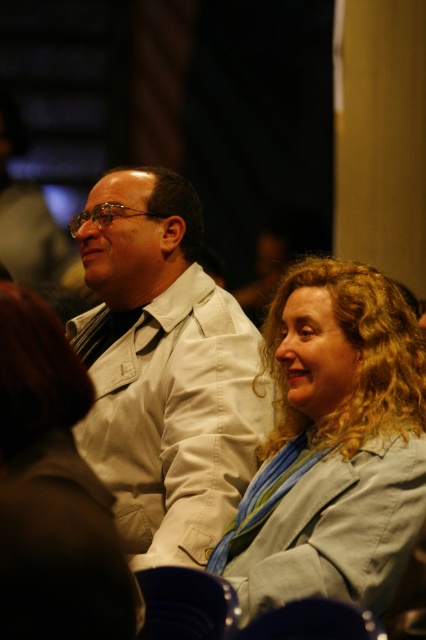
Question: Which point is farther to the camera?

Choices:
 (A) light beige jacket at center
 (B) light blue fabric jacket at center

Answer: (A)

Question: Which point is farther to the camera?

Choices:
 (A) (270, 548)
 (B) (164, 352)

Answer: (B)

Question: Is light beige jacket at center thinner than light blue fabric jacket at center?

Choices:
 (A) no
 (B) yes

Answer: (A)

Question: Does light beige jacket at center have a lesser width compared to light blue fabric jacket at center?

Choices:
 (A) no
 (B) yes

Answer: (A)

Question: Is light beige jacket at center positioned behind light blue fabric jacket at center?

Choices:
 (A) yes
 (B) no

Answer: (A)